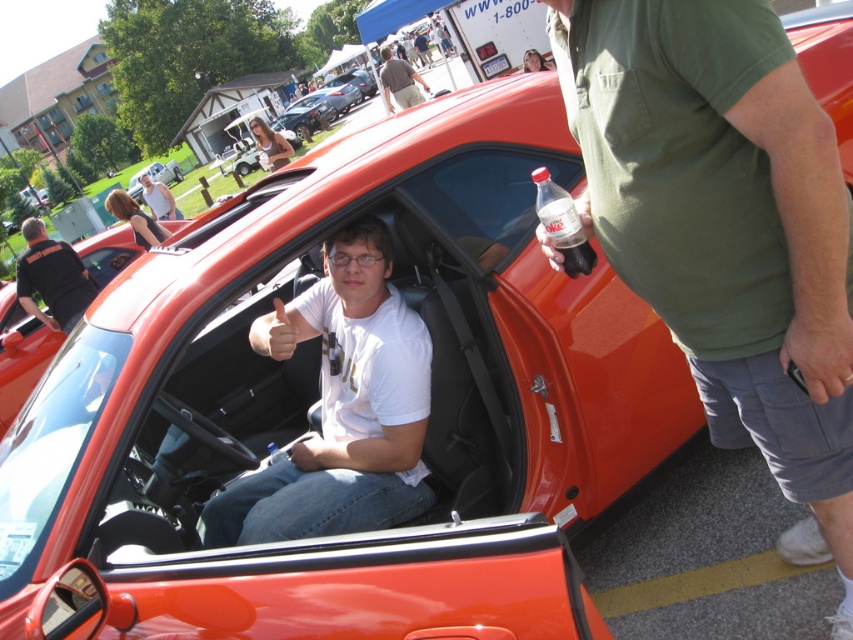
Between brown cotton shirt at center and shiny metallic car at center, which one is positioned lower?

brown cotton shirt at center

Which of these two, brown cotton shirt at center or shiny metallic car at center, stands taller?

shiny metallic car at center is taller.

Who is more distant from viewer, (409, 68) or (167, 179)?

Positioned behind is point (167, 179).

This screenshot has height=640, width=853. Identify the location of brown cotton shirt at center. (399, 81).

From the picture: Is green cotton shirt at right taller than clear plastic bottle at center?

Yes.

Can you confirm if green cotton shirt at right is shorter than clear plastic bottle at center?

Incorrect, green cotton shirt at right's height does not fall short of clear plastic bottle at center's.

Between point (827, 461) and point (581, 230), which one is positioned in front?

Positioned in front is point (827, 461).

The image size is (853, 640). Find the location of `green cotton shirt at right`. green cotton shirt at right is located at coordinates (726, 228).

Who is positioned more to the left, matte white t-shirt at center or shiny metallic car at center?

shiny metallic car at center is more to the left.

What do you see at coordinates (158, 198) in the screenshot?
I see `matte white t-shirt at center` at bounding box center [158, 198].

In order to click on matte white t-shirt at center in this screenshot , I will do `click(158, 198)`.